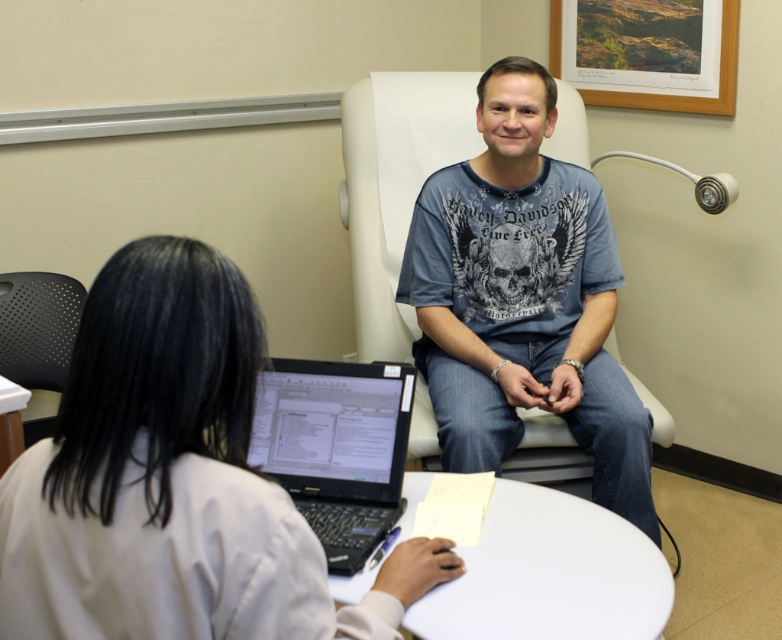
Question: Is blue cotton t-shirt at center to the left of black plastic laptop at center from the viewer's perspective?

Choices:
 (A) yes
 (B) no

Answer: (B)

Question: Which is nearer to the black perforated chair at left?

Choices:
 (A) white lab coat at center
 (B) white smooth table at center
 (C) black plastic laptop at center
 (D) blue cotton t-shirt at center

Answer: (C)

Question: In this image, where is white lab coat at center located relative to black plastic laptop at center?

Choices:
 (A) below
 (B) above

Answer: (A)

Question: Based on their relative distances, which object is nearer to the black plastic laptop at center?

Choices:
 (A) black perforated chair at left
 (B) white smooth table at center
 (C) blue cotton t-shirt at center
 (D) white lab coat at center

Answer: (B)

Question: Estimate the real-world distances between objects in this image. Which object is closer to the black plastic laptop at center?

Choices:
 (A) blue cotton t-shirt at center
 (B) black perforated chair at left

Answer: (A)

Question: Where is blue cotton t-shirt at center located in relation to white smooth table at center in the image?

Choices:
 (A) right
 (B) left

Answer: (A)